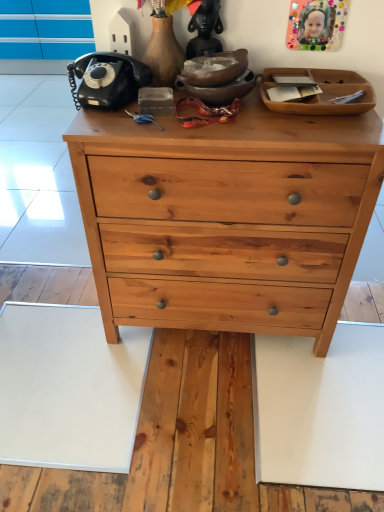
Locate an element on the screen. The width and height of the screenshot is (384, 512). free location above natural wood chest of drawers at center (from a real-world perspective) is located at coordinates (226, 113).